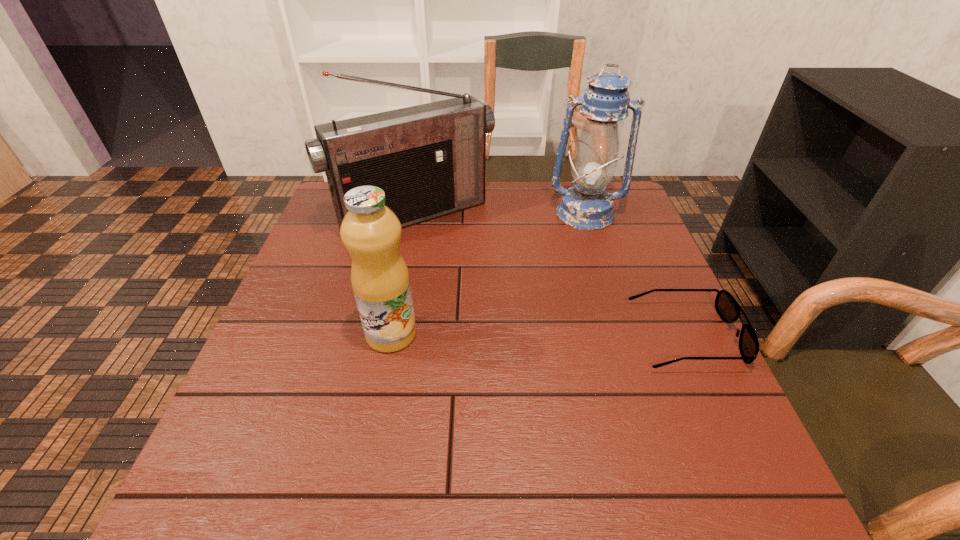
Where is `free spot located 0.170m on the front-facing side of the lantern`? This screenshot has width=960, height=540. free spot located 0.170m on the front-facing side of the lantern is located at coordinates (582, 270).

Identify the location of radio receiver that is at the far edge. (430, 160).

Where is `lantern located at the far edge`? This screenshot has height=540, width=960. lantern located at the far edge is located at coordinates (586, 206).

You are a GUI agent. You are given a task and a screenshot of the screen. Output one action in this format:
    pyautogui.click(x=<x>, y=<y>)
    Task: Click on the object that is at the left edge
    The image size is (960, 540).
    Given the screenshot: What is the action you would take?
    pyautogui.click(x=430, y=160)

Where is `spectacles that is at the right edge`? The height and width of the screenshot is (540, 960). spectacles that is at the right edge is located at coordinates (728, 309).

Locate an element on the screen. lantern positioned at the right edge is located at coordinates (586, 206).

Where is `object present at the far left corner`? The image size is (960, 540). object present at the far left corner is located at coordinates (430, 160).

Find the location of a particular element. object that is at the far right corner is located at coordinates (586, 206).

The image size is (960, 540). I want to click on vacant space at the far edge of the desktop, so click(x=567, y=188).

The width and height of the screenshot is (960, 540). In the image, there is a desktop. What are the coordinates of `vacant area at the left edge` in the screenshot? It's located at (285, 389).